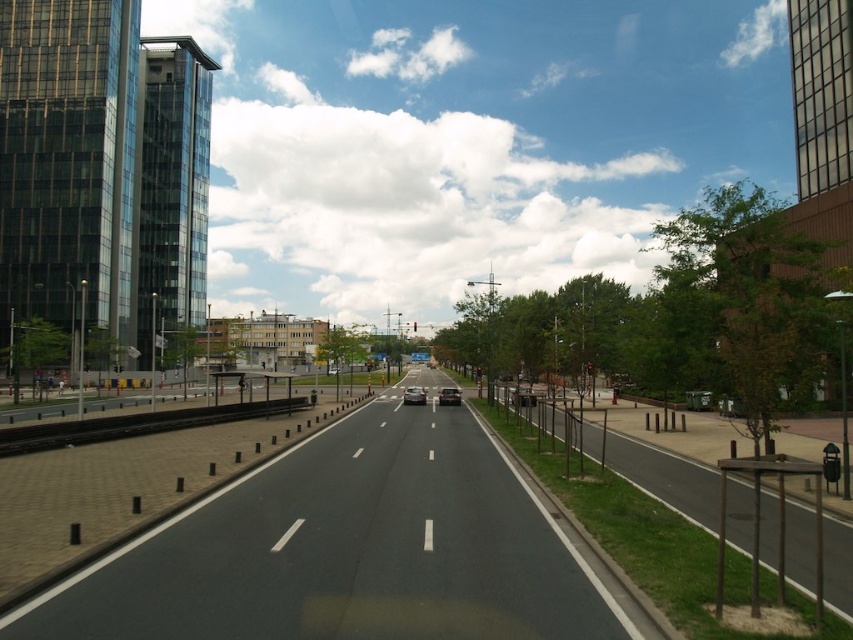
You are a pedestrian standing on the sidewalk on the left side of the street. You want to cross the street to reach the shiny black sedan at center. The crosswalk is directly in front of you. However, there is a shiny silver car at center in your path. Can you safely walk between them without getting too close?

The shiny silver car at center and shiny black sedan at center are 6.21 feet apart. Since 6.21 feet is approximately 1.89 meters, which is a safe distance for a pedestrian to walk between them without being too close.